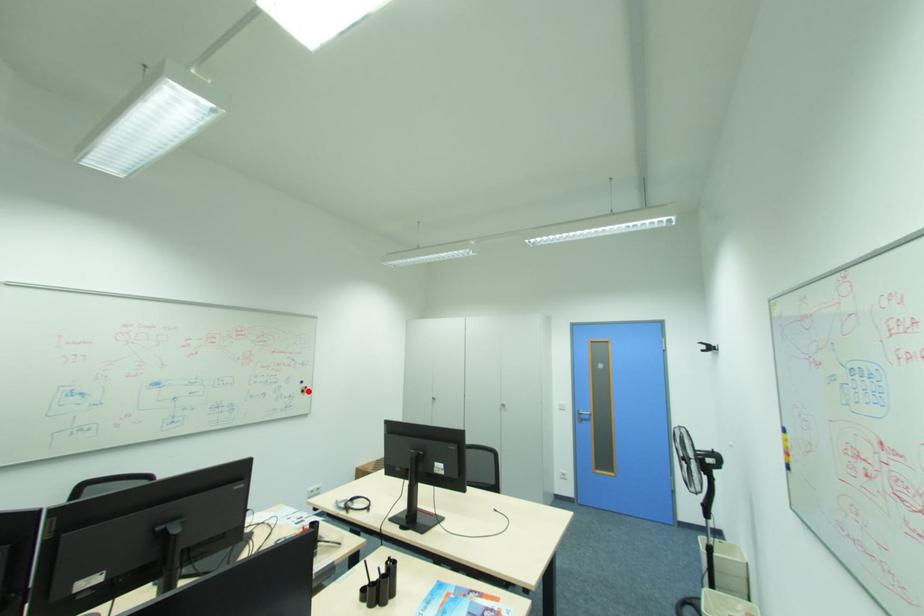
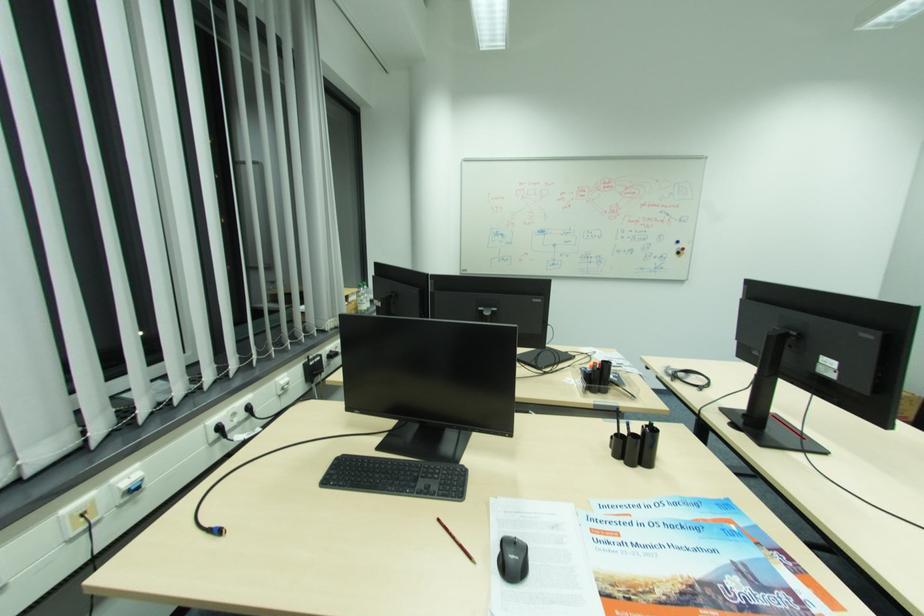
The point at the highlighted location is marked in the first image. Where is the corresponding point in the second image?

(684, 253)